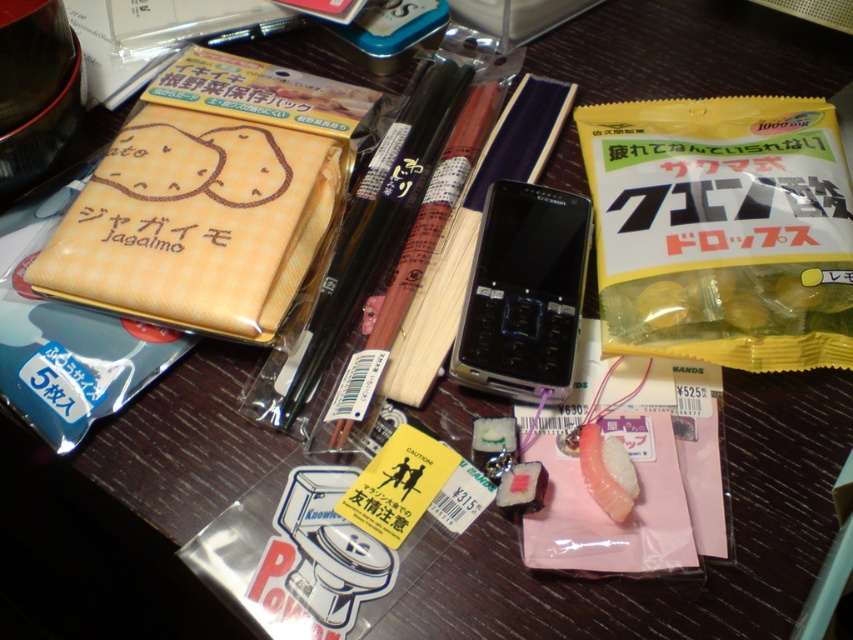
Can you confirm if yellow fabric pouch at upper left is bigger than pink glossy sushi at center?

Yes, yellow fabric pouch at upper left is bigger than pink glossy sushi at center.

Based on the photo, can you confirm if yellow fabric pouch at upper left is thinner than pink glossy sushi at center?

No, yellow fabric pouch at upper left is not thinner than pink glossy sushi at center.

Does point (242, 292) come farther from viewer compared to point (514, 499)?

Yes.

Where is `yellow fabric pouch at upper left`? yellow fabric pouch at upper left is located at coordinates (195, 224).

Does yellow gelatinous candies at center right appear on the left side of pink glossy sushi at center?

No, yellow gelatinous candies at center right is not to the left of pink glossy sushi at center.

Can you confirm if yellow gelatinous candies at center right is thinner than pink glossy sushi at center?

Answer: Incorrect, yellow gelatinous candies at center right's width is not less than pink glossy sushi at center's.

Between point (816, 288) and point (544, 483), which one is positioned behind?

The point (816, 288) is behind.

Locate an element on the screen. yellow gelatinous candies at center right is located at coordinates (730, 301).

Consider the image. Does white glossy fish at center appear under pink glossy sushi at center?

No, white glossy fish at center is not below pink glossy sushi at center.

From the picture: Is white glossy fish at center shorter than pink glossy sushi at center?

No.

Is point (579, 433) positioned after point (514, 499)?

Yes, point (579, 433) is farther from viewer.

Where is `white glossy fish at center`? This screenshot has width=853, height=640. white glossy fish at center is located at coordinates (605, 472).